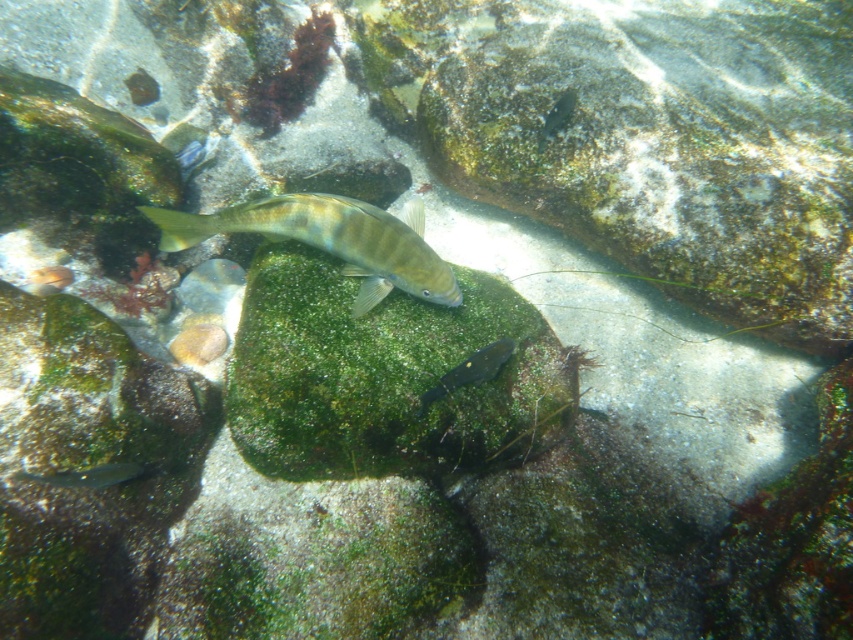
You are an underwater photographer aiming to capture both the shiny silver fish at center and the shiny silver fish at lower left in a single frame. Based on their sizes, which fish should you focus on to ensure both fit in the shot?

The shiny silver fish at center might be wider than the shiny silver fish at lower left, so focusing on the wider fish at center would help ensure both fit in the frame.